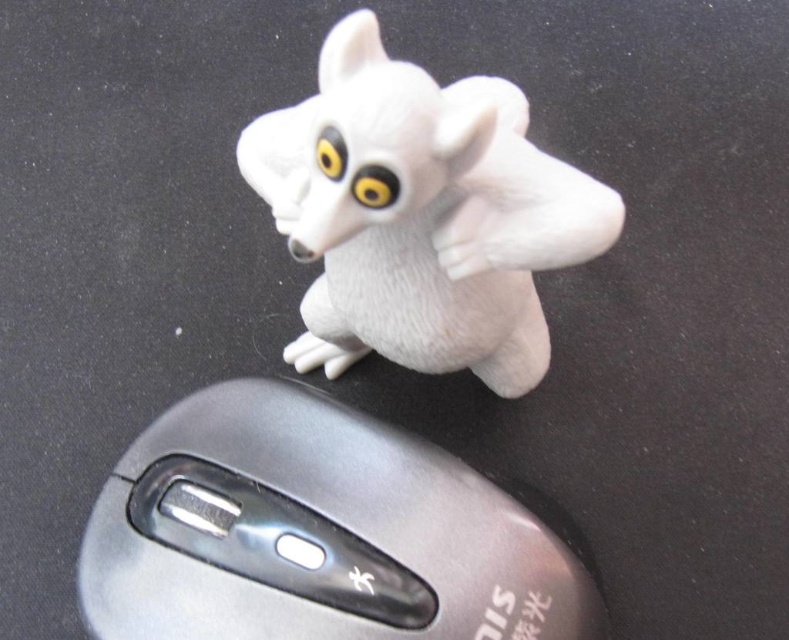
Between black plastic mouse at lower left and white matte/soft toy at center, which one appears on the right side from the viewer's perspective?

From the viewer's perspective, white matte/soft toy at center appears more on the right side.

Can you confirm if black plastic mouse at lower left is taller than white matte/soft toy at center?

No, black plastic mouse at lower left is not taller than white matte/soft toy at center.

This screenshot has height=640, width=789. I want to click on black plastic mouse at lower left, so click(316, 532).

Image resolution: width=789 pixels, height=640 pixels. In order to click on black plastic mouse at lower left in this screenshot , I will do `click(316, 532)`.